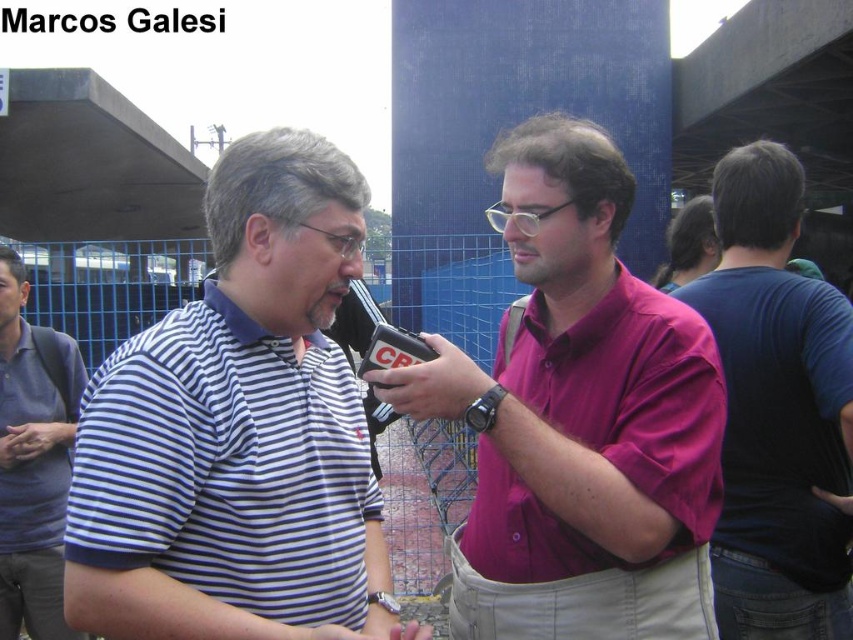
You are standing at the point labeled as point (268, 310) in the image. You want to take a photo of the camera with the CB logo using your phone. Since your phone can only focus on objects within 25 feet, will you be able to take a clear photo of the camera?

The point labeled point (268, 310) is 26.13 feet away from the camera. Since your phone can only focus on objects within 25 feet, you will not be able to take a clear photo of the camera because the distance exceeds the focus range.